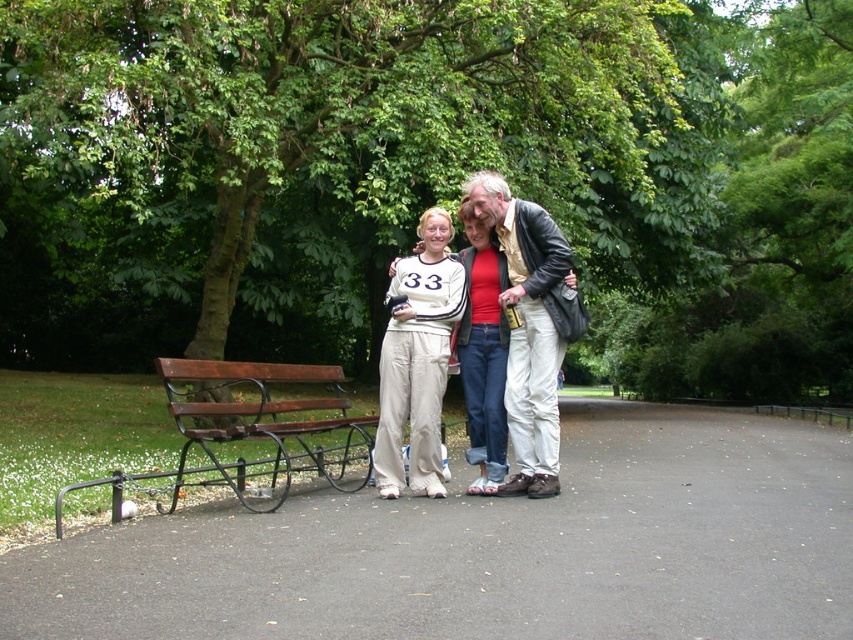
You are standing at the origin of the coordinate system. You see a green leafy tree at center and a wooden bench with metal supports positioned slightly to the left of the group. Where is the point at coordinates point (323, 154) located?

The point at coordinates point (323, 154) is located on the green leafy tree at center.

You are planning to place a picnic blanket between the green leafy tree at center and the matte black leather jacket at center. What is the minimum length of the picnic blanket needed to stretch between them?

The green leafy tree at center and matte black leather jacket at center are 9.28 meters apart from each other, so the minimum length of the picnic blanket needed to stretch between them is 9.28 meters.

You are a photographer standing in the park and want to take a photo of the green leafy tree at center and the brown wooden bench at left. Which object should you focus on first if you want to capture both in sharp focus?

The green leafy tree at center is further to the viewer than the brown wooden bench at left, so you should focus on the green leafy tree at center first to ensure both are in focus.